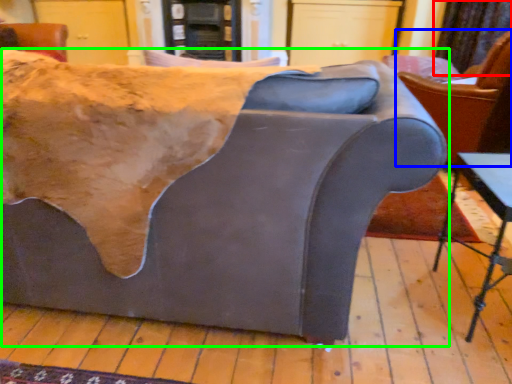
Question: Based on their relative distances, which object is farther from curtain (highlighted by a red box)? Choose from chair (highlighted by a blue box) and studio couch (highlighted by a green box).

Choices:
 (A) chair
 (B) studio couch

Answer: (B)